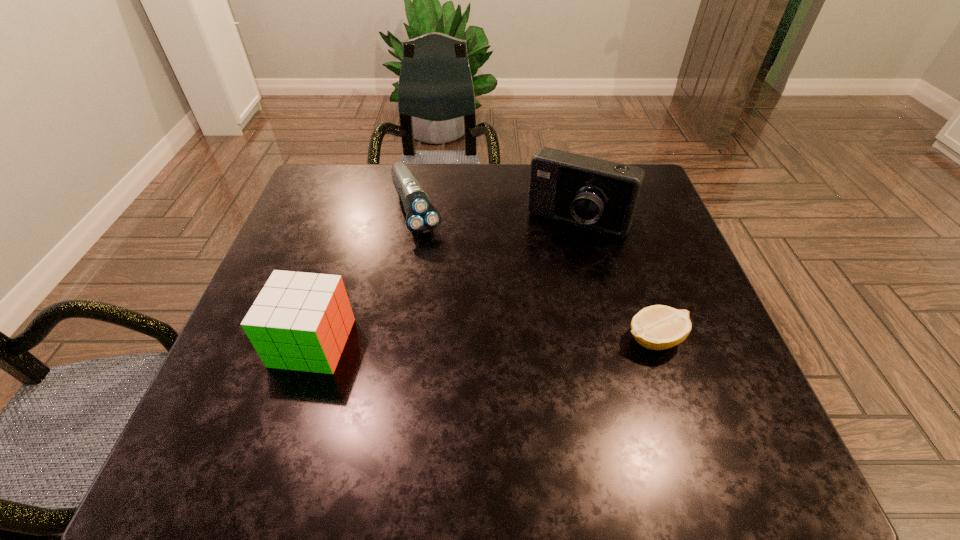
Identify the location of vacant point that satisfies the following two spatial constraints: 1. on the front side of the camera; 2. on the left side of the lemon. (606, 339).

In order to click on free spot that satisfies the following two spatial constraints: 1. on the front side of the camera; 2. on the left side of the third tallest object in this screenshot , I will do `click(415, 222)`.

The image size is (960, 540). What are the coordinates of `vacant space that satisfies the following two spatial constraints: 1. on the front side of the camera; 2. on the left side of the shortest object` in the screenshot? It's located at (606, 339).

Locate an element on the screen. The width and height of the screenshot is (960, 540). vacant point that satisfies the following two spatial constraints: 1. on the back side of the leftmost object; 2. on the right side of the third object from right to left is located at coordinates (355, 210).